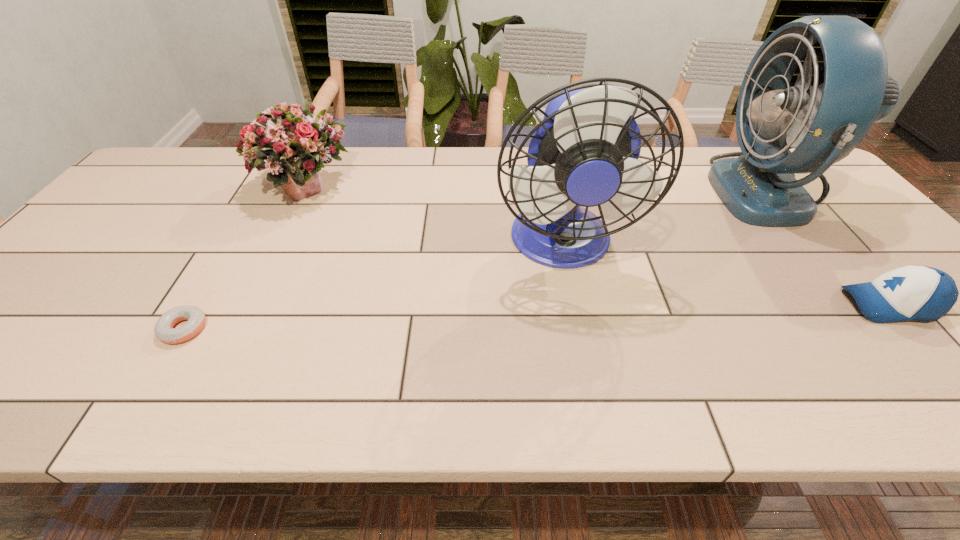
I want to click on vacant space located on the front-facing side of the second shortest object, so click(790, 305).

Identify the location of vacant space located 0.200m on the front-facing side of the second shortest object. This screenshot has height=540, width=960. (755, 305).

This screenshot has height=540, width=960. I want to click on vacant space located on the front-facing side of the second shortest object, so click(732, 305).

Where is `vacant space situated 0.090m on the left of the doughnut`? This screenshot has height=540, width=960. vacant space situated 0.090m on the left of the doughnut is located at coordinates (120, 329).

This screenshot has width=960, height=540. Find the location of `fan located at the far edge`. fan located at the far edge is located at coordinates (824, 118).

Where is `bouquet that is at the far edge`? Image resolution: width=960 pixels, height=540 pixels. bouquet that is at the far edge is located at coordinates (294, 145).

This screenshot has height=540, width=960. I want to click on fan that is at the right edge, so click(x=824, y=118).

Where is `baseball cap that is at the right edge`? The width and height of the screenshot is (960, 540). baseball cap that is at the right edge is located at coordinates (x=913, y=292).

Image resolution: width=960 pixels, height=540 pixels. In order to click on object that is at the far right corner in this screenshot , I will do `click(824, 118)`.

This screenshot has width=960, height=540. Find the location of `vacant space at the far edge`. vacant space at the far edge is located at coordinates pos(427,186).